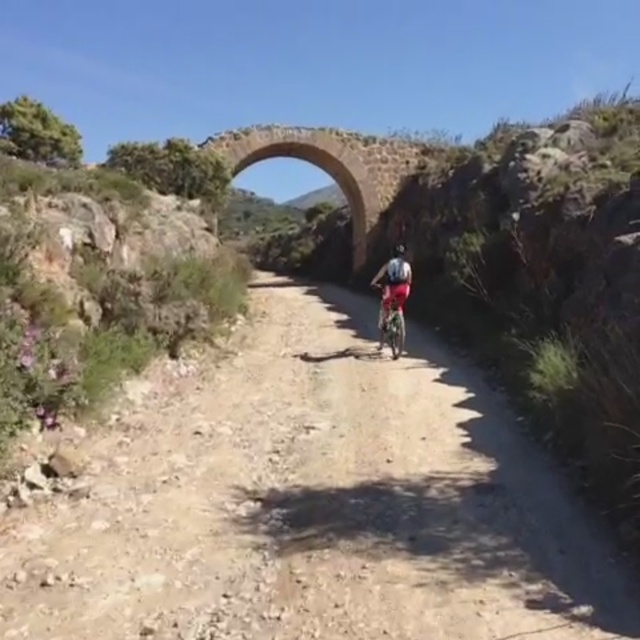
You are a hiker carrying a large backpack and need to walk through the dirt path at center and under the stone archway at center. Can you pass through both without bending down?

The dirt path at center is taller than the stone archway at center, so you will need to bend down when passing under the stone archway at center but not the dirt path at center.

You are a hiker carrying a 10 meter long ladder. You see the stone archway at center and the shiny metallic bicycle at center. Can you place the ladder between them without bending it?

The distance between the stone archway at center and the shiny metallic bicycle at center is 12.01 meters. Since the ladder is only 10 meters long, it is too short to span the distance between them without bending.

You are standing at the point marked as point (312, 502) in the image. What is the most prominent feature directly in front of you along the dirt path at center?

The dirt path at center is located at point (312, 502), so the most prominent feature directly in front of you along the dirt path at center is the stone arch bridge spanning across the path in the background.